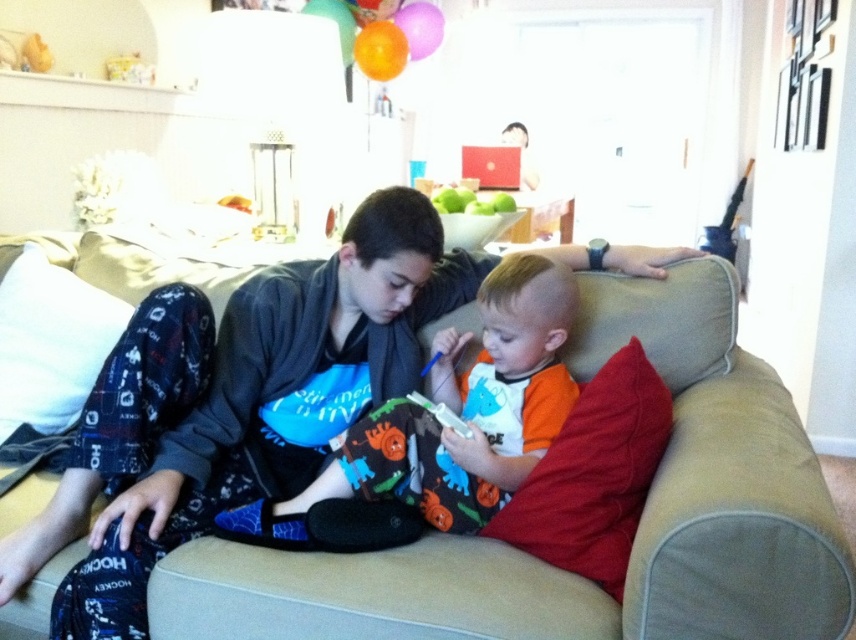
Can you confirm if beige fabric couch at center is shorter than orange cotton shirt at center?

No, beige fabric couch at center is not shorter than orange cotton shirt at center.

Between point (696, 324) and point (531, 326), which one is positioned behind?

The point (696, 324) is more distant.

I want to click on beige fabric couch at center, so click(x=637, y=531).